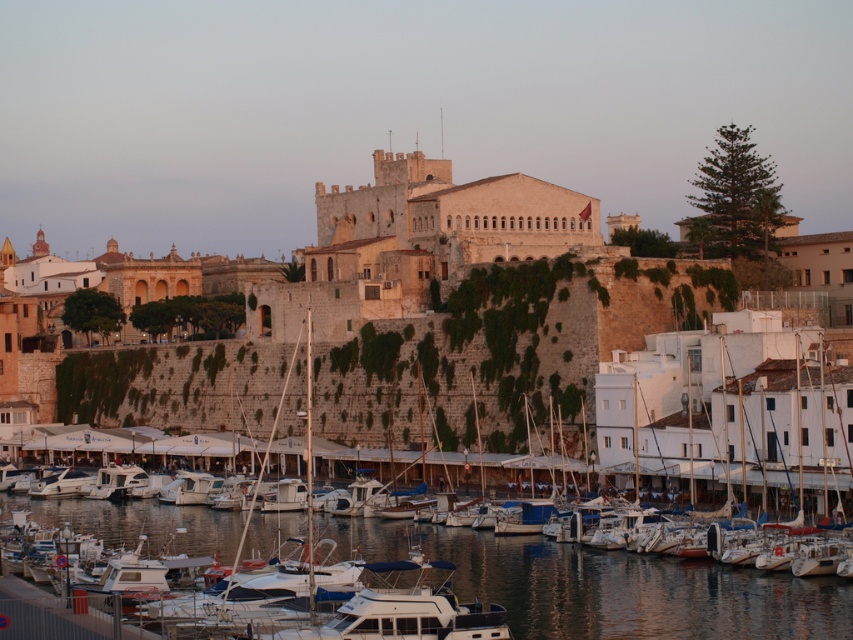
You are a photographer planning to capture the stone wall at center and the white matte sailboat at center in a single frame. Considering their sizes, which object should you focus on to ensure both are clearly visible without cropping?

Since the stone wall at center is larger in size than the white matte sailboat at center, you should focus on the stone wall at center to ensure both are clearly visible without cropping.

You are a photographer standing at the edge of the harbor. You want to capture a photo of the white matte sailboat at center and the clear water at lower center. Which object is positioned higher in the frame?

The white matte sailboat at center is positioned higher in the frame than the clear water at lower center.

You are standing at the waterfront and want to take a photo of the stone wall at center and the clear water at lower center. Which object should you focus on first if you want to capture both in a single frame without moving your camera?

You should focus on the clear water at lower center first because the stone wall at center is located above it, so by framing the lower area first, you can include both objects in the same shot.